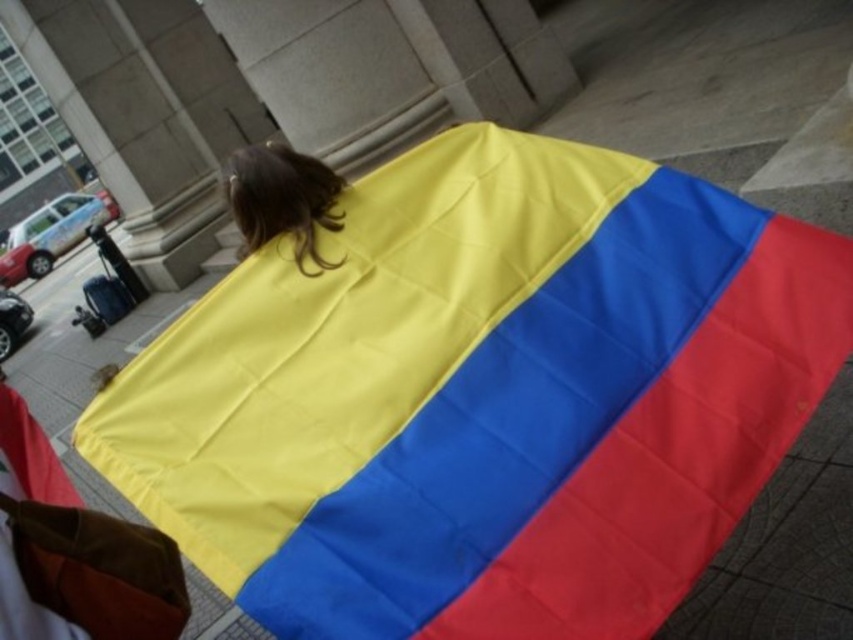
Question: Does polyester flag at center lie in front of shiny brown hair at upper center?

Choices:
 (A) yes
 (B) no

Answer: (A)

Question: Which object is farther from the camera taking this photo?

Choices:
 (A) polyester flag at center
 (B) shiny brown hair at upper center

Answer: (B)

Question: Which of the following is the closest to the observer?

Choices:
 (A) (503, 369)
 (B) (322, 212)

Answer: (A)

Question: Is polyester flag at center below shiny brown hair at upper center?

Choices:
 (A) no
 (B) yes

Answer: (B)

Question: Can you confirm if polyester flag at center is smaller than shiny brown hair at upper center?

Choices:
 (A) no
 (B) yes

Answer: (A)